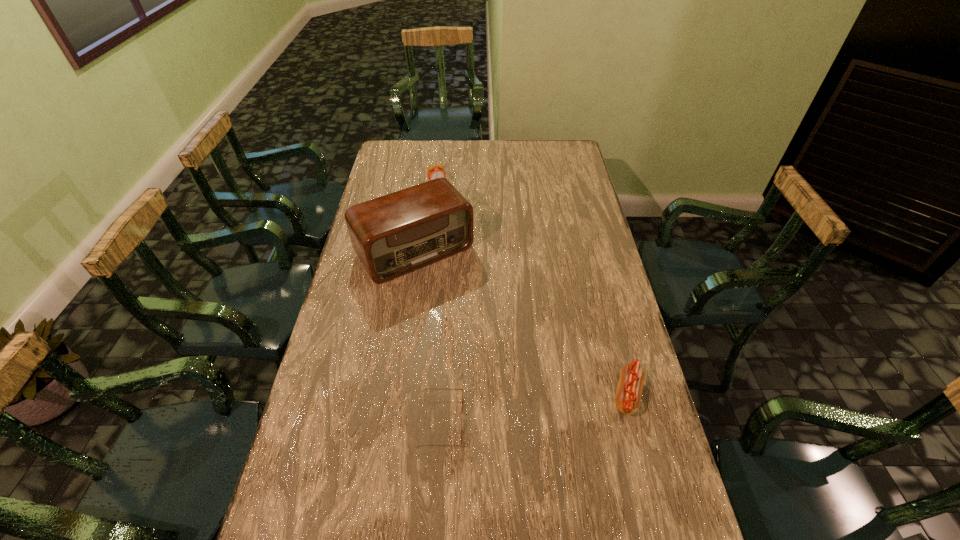
You are a GUI agent. You are given a task and a screenshot of the screen. Output one action in this format:
    pyautogui.click(x=<x>, y=<y>)
    Task: Click on the blank space at the far left corner of the desktop
    
    Given the screenshot: What is the action you would take?
    pyautogui.click(x=394, y=149)

Where is `free spot between the third shortest object and the rightmost object`? The height and width of the screenshot is (540, 960). free spot between the third shortest object and the rightmost object is located at coordinates (533, 290).

Identify the location of vacant region between the rightmost object and the tallest object. The width and height of the screenshot is (960, 540). (521, 323).

The width and height of the screenshot is (960, 540). I want to click on vacant space that's between the sausage and the radio receiver, so click(521, 323).

At what (x,y) coordinates should I click in order to perform the action: click on vacant space in between the rightmost object and the farthest object. Please return your answer as a coordinate pair (x, y). This screenshot has height=540, width=960. Looking at the image, I should click on (533, 290).

Locate an element on the screen. empty space that is in between the third tallest object and the second tallest object is located at coordinates (533, 290).

The width and height of the screenshot is (960, 540). I want to click on object that is the closest to the tallest object, so pos(434,172).

I want to click on object identified as the closest to the sausage, so click(428, 388).

The height and width of the screenshot is (540, 960). I want to click on free location that satisfies the following two spatial constraints: 1. on the front side of the sunglasses; 2. on the face of the farthest object, so click(409, 421).

The image size is (960, 540). I want to click on vacant area in the image that satisfies the following two spatial constraints: 1. on the front side of the farthest object; 2. on the face of the sunglasses, so click(x=409, y=421).